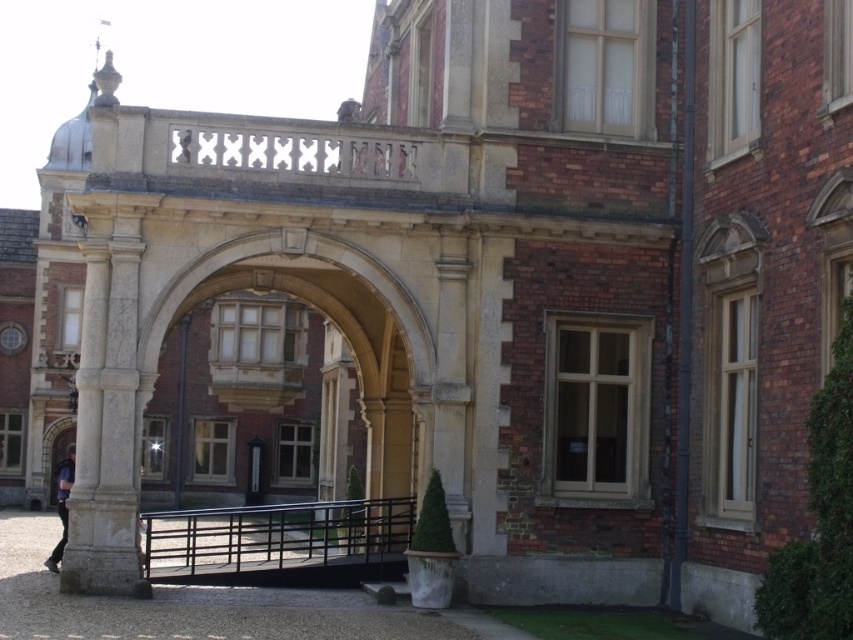
You are a photographer standing in front of the grand historic building. You want to capture a photo that includes both the white marble column at left and the blue fabric shirt at lower left. Which object should you adjust your camera angle to focus on first to ensure both are in frame?

The white marble column at left is taller than the blue fabric shirt at lower left, so you should focus on including the white marble column at left in your frame first to ensure the shorter blue fabric shirt at lower left also fits into the photo.

You are an interior designer assessing the grand historic building. You notice the white marble column at left and the blue fabric shirt at lower left. Which object has a greater width?

The white marble column at left has a greater width than the blue fabric shirt at lower left.

You are standing in front of the grand historic building and notice the smooth stone archway at center and the blue fabric shirt at lower left. Which object is closer to you?

The smooth stone archway at center is closer to you because it is in front of the blue fabric shirt at lower left.